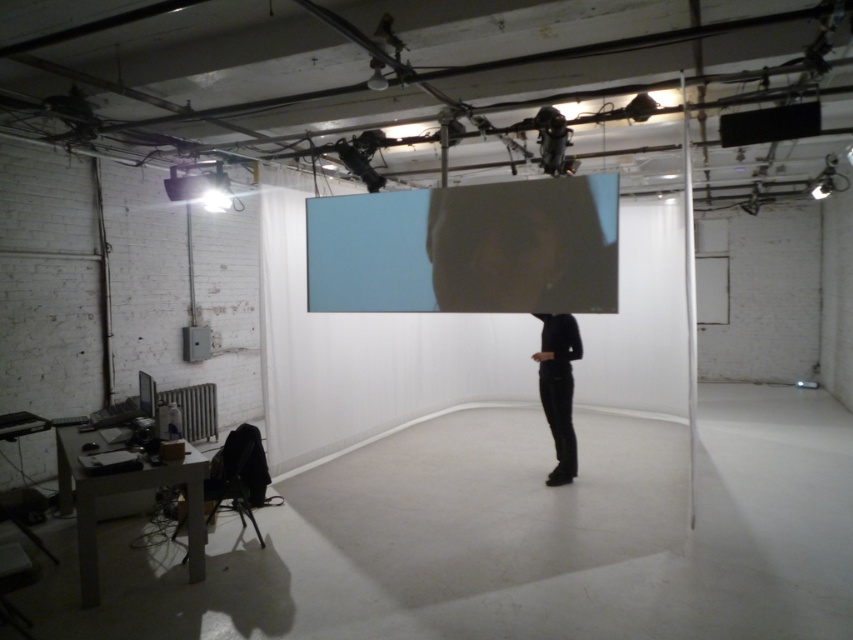
Question: Is matte blue screen at center wider than black matte pants at center?

Choices:
 (A) no
 (B) yes

Answer: (B)

Question: Does matte blue screen at center appear under black matte pants at center?

Choices:
 (A) no
 (B) yes

Answer: (A)

Question: Which point is closer to the camera?

Choices:
 (A) (495, 296)
 (B) (573, 332)

Answer: (A)

Question: Which of the following is the farthest from the observer?

Choices:
 (A) (543, 364)
 (B) (550, 227)

Answer: (A)

Question: Among these points, which one is farthest from the camera?

Choices:
 (A) (560, 438)
 (B) (476, 307)

Answer: (A)

Question: Can you confirm if matte blue screen at center is bigger than black matte pants at center?

Choices:
 (A) no
 (B) yes

Answer: (B)